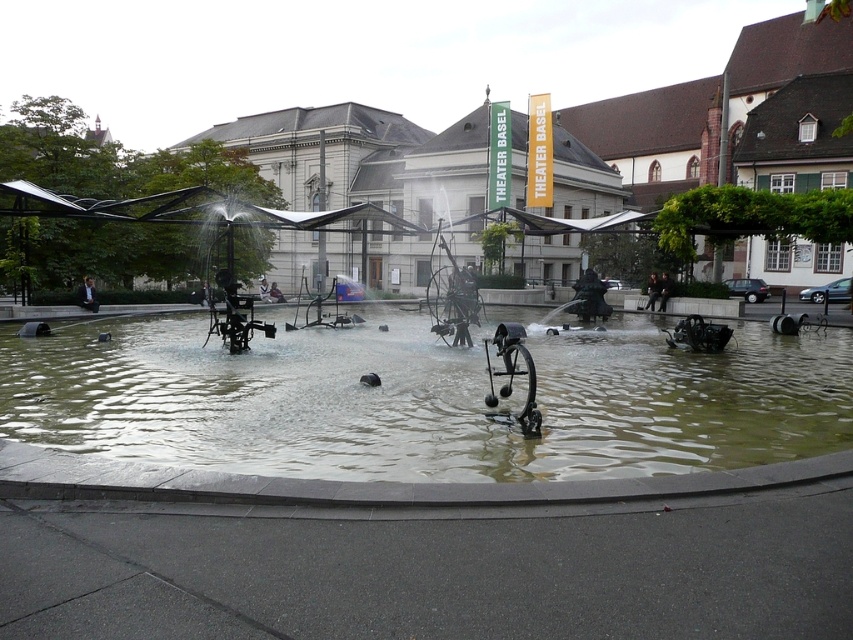
You are standing in the public square and want to take a photo of the fountain. You notice two points in the scene labeled as point 1 and point 2. If point 1 is at coordinates point (x=366, y=435) and point 2 is at coordinates point (x=280, y=296), which point will appear larger in your photo?

Point 1 at coordinates point (x=366, y=435) will appear larger in the photo because it is closer to the camera than point 2 at coordinates point (x=280, y=296).

You are standing in the public square and want to take a photo of the greenish murky water at center. If your camera has a 5 meter range, will you be able to capture it clearly?

The greenish murky water at center and viewer are 6.28 meters apart, so the camera with a 5 meter range cannot capture it clearly as the distance exceeds the maximum range.